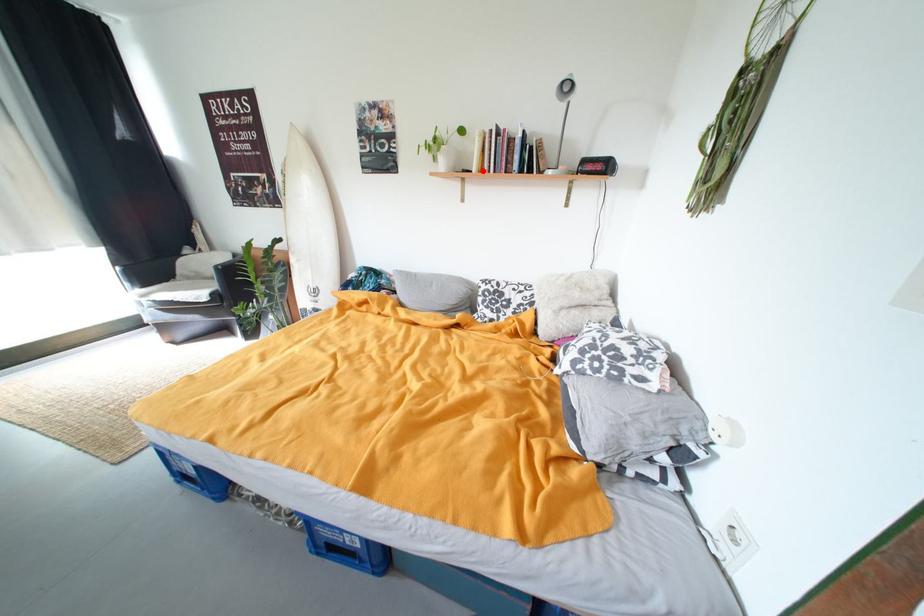
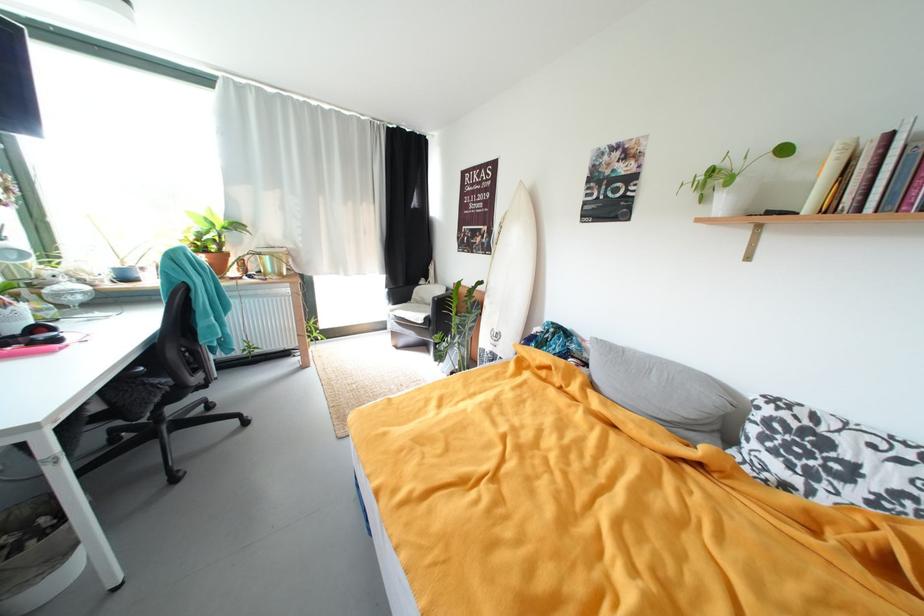
In the second image, find the point that corresponds to the highlighted location in the first image.

(817, 209)